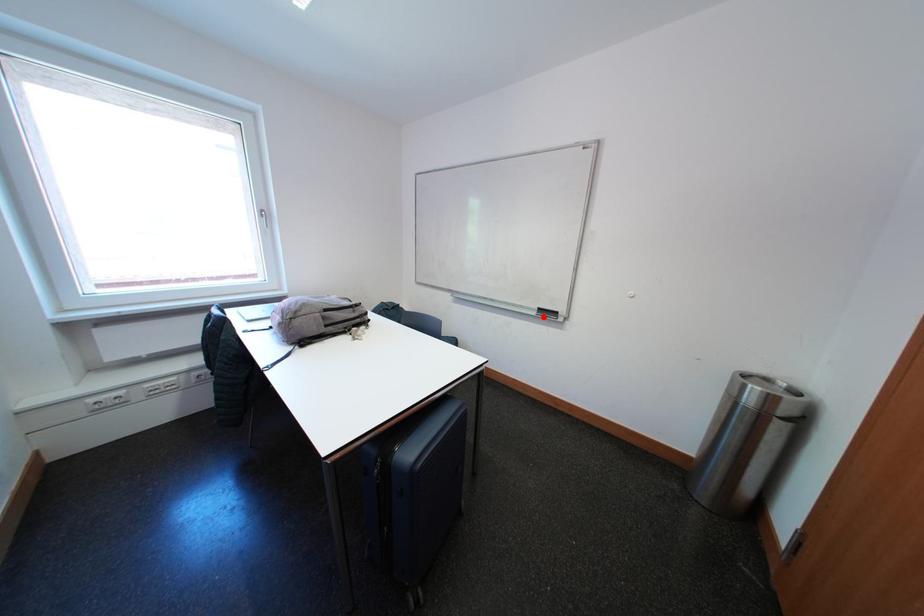
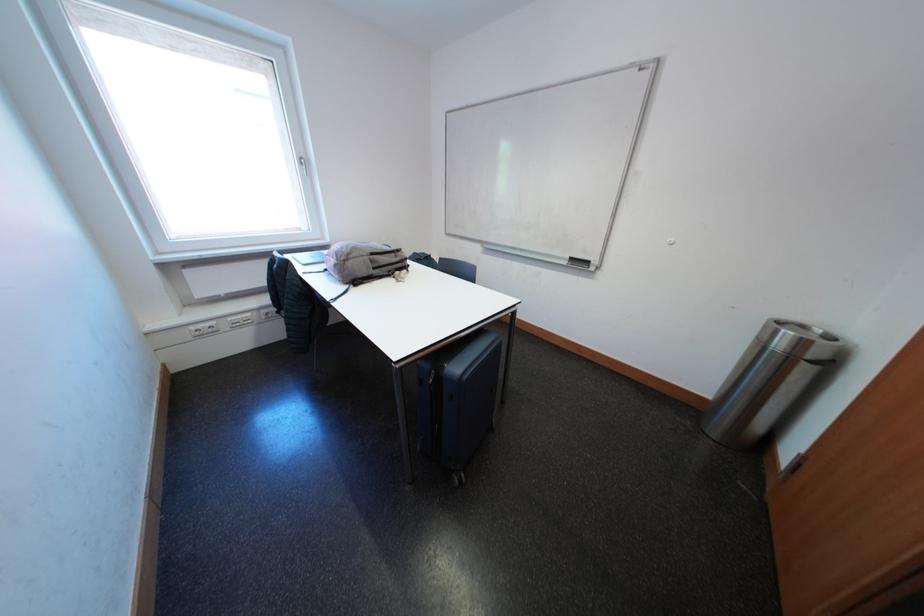
Question: A red point is marked in image1. In image2, is the corresponding 3D point closer to the camera or farther? Reply with the corresponding letter.

Choices:
 (A) The corresponding 3D point is closer.
 (B) The corresponding 3D point is farther.

Answer: (A)